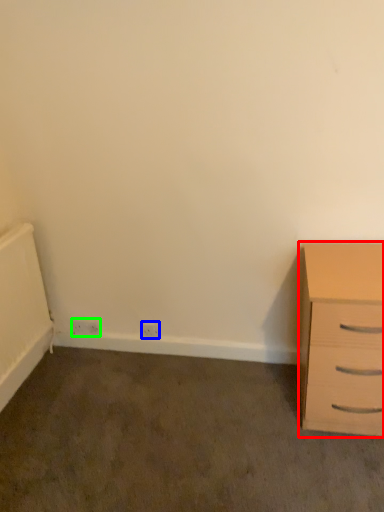
Question: Based on their relative distances, which object is farther from chest of drawers (highlighted by a red box)? Choose from electric outlet (highlighted by a blue box) and electric outlet (highlighted by a green box).

Choices:
 (A) electric outlet
 (B) electric outlet

Answer: (B)